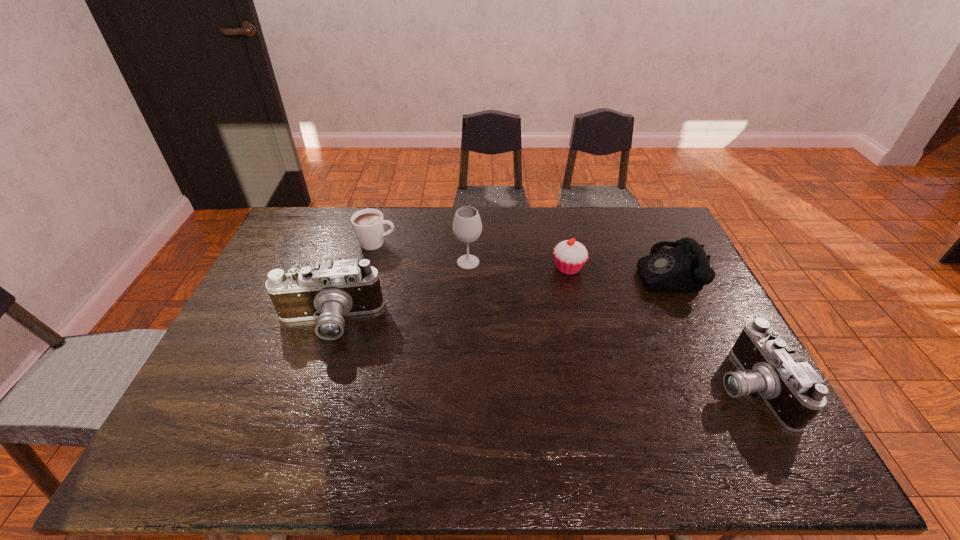
Please mark a free spot for a new camera to balance the arrangement. Please provide its 2D coordinates. Your answer should be formatted as a tuple, i.e. [(x, y)], where the tuple contains the x and y coordinates of a point satisfying the conditions above.

[(524, 352)]